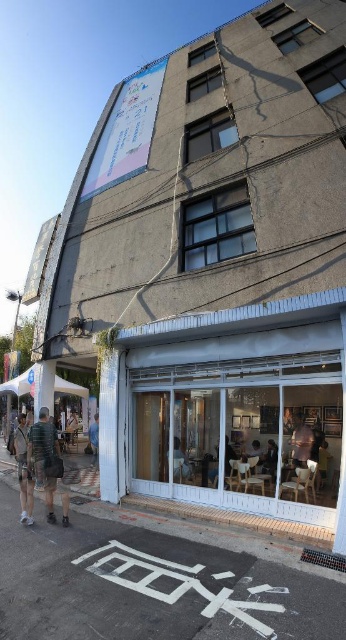
Looking at this image, you are standing outside the building and want to compare the height of the white glass storefront at lower right and the striped fabric shirt at lower left. Which one is taller?

The white glass storefront at lower right is much taller than the striped fabric shirt at lower left.

You are standing at the entrance of the building and want to walk to a specific location. If you see two points marked on the ground, one at point (320,396) and another at point (31,426), which point is closer to you as you face the building?

Point (31,426) is closer to you because it is in front of point (320,396).

Looking at this image, you are standing at the entrance of the building and want to locate the white glass storefront at lower right. According to the coordinates provided, where should you look relative to your position?

The white glass storefront at lower right is located at coordinates point (x=232, y=410), which means it is positioned to the lower right relative to your current position at the entrance.